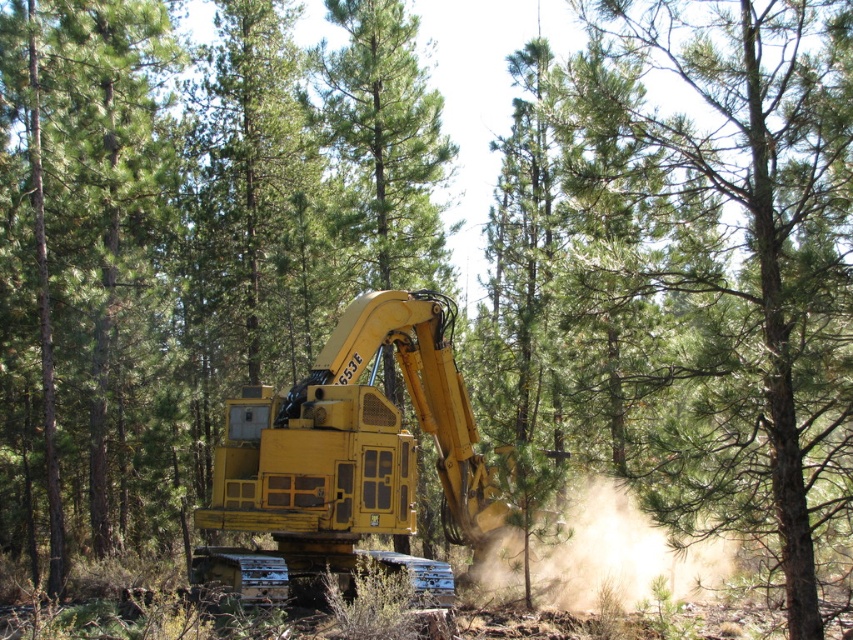
Question: Which of these objects is positioned closest to the yellow metallic excavator at center?

Choices:
 (A) brown dusty cloud at center
 (B) green leafy tree at center

Answer: (A)

Question: Estimate the real-world distances between objects in this image. Which object is farther from the green leafy tree at center?

Choices:
 (A) brown dusty cloud at center
 (B) yellow metallic excavator at center

Answer: (B)

Question: Is green matte tree at center to the left of yellow metallic excavator at center from the viewer's perspective?

Choices:
 (A) no
 (B) yes

Answer: (B)

Question: Where is green matte tree at center located in relation to brown dusty cloud at center in the image?

Choices:
 (A) below
 (B) above

Answer: (B)

Question: From the image, what is the correct spatial relationship of green leafy tree at center in relation to yellow metallic excavator at center?

Choices:
 (A) above
 (B) below

Answer: (A)

Question: Which point appears farthest from the camera in this image?

Choices:
 (A) (718, 568)
 (B) (788, 228)

Answer: (A)